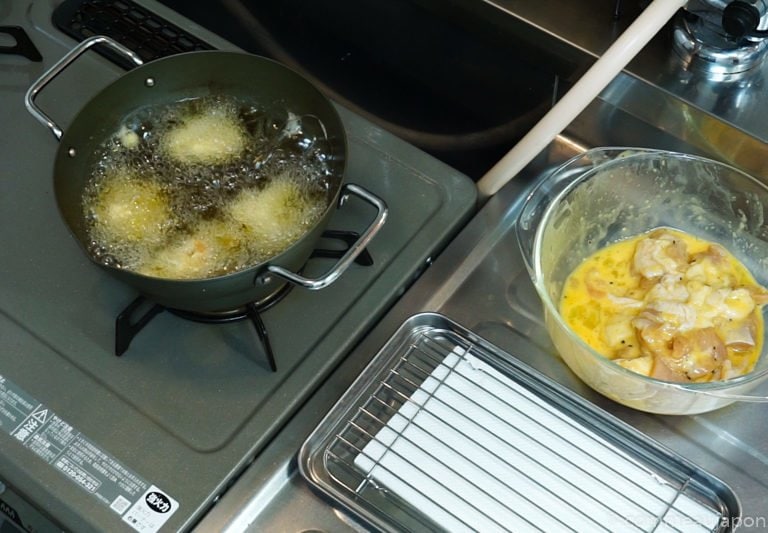
Find the location of `food in clear glass bowl`. food in clear glass bowl is located at coordinates (684, 304).